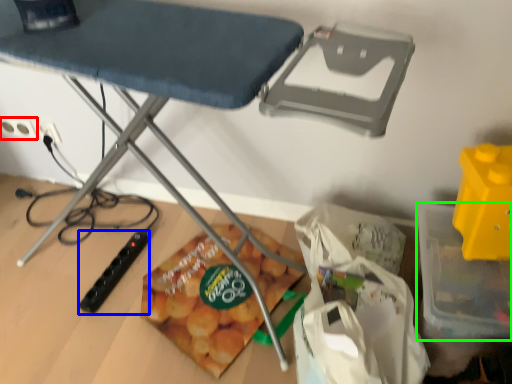
Question: Which object is positioned closest to electric outlet (highlighted by a red box)? Select from toy (highlighted by a blue box) and storage box (highlighted by a green box).

Choices:
 (A) toy
 (B) storage box

Answer: (A)